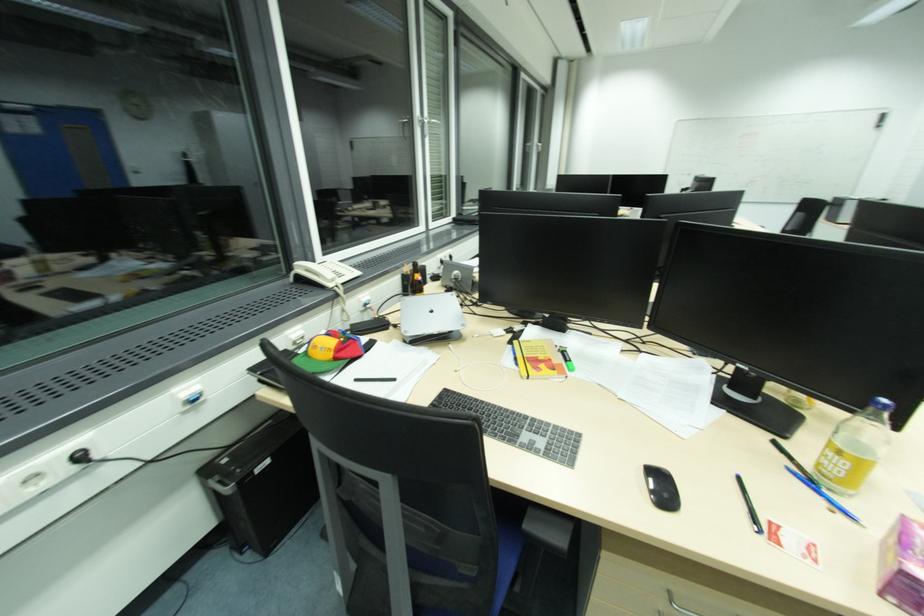
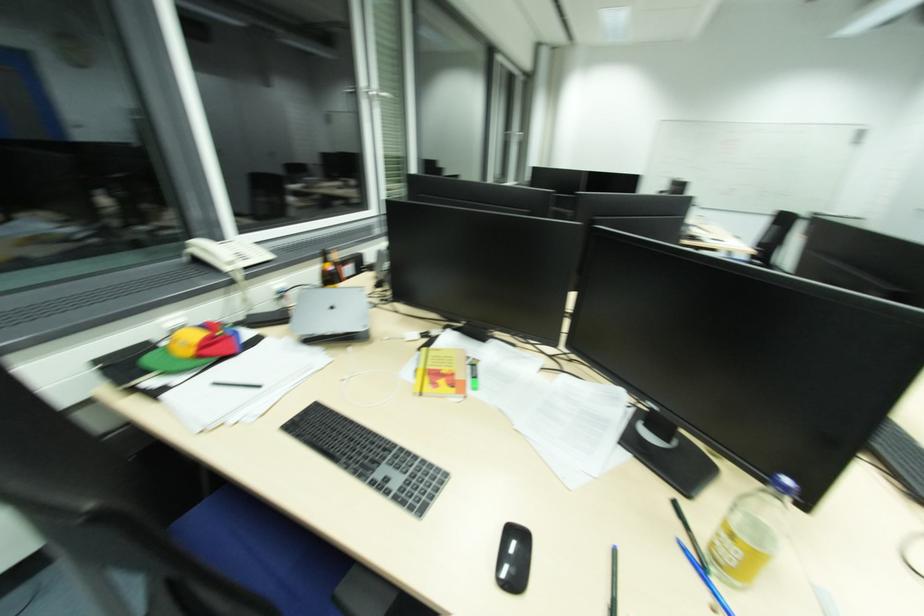
Find the pixel in the second image that matches the point at 544,368 in the first image.

(444, 383)